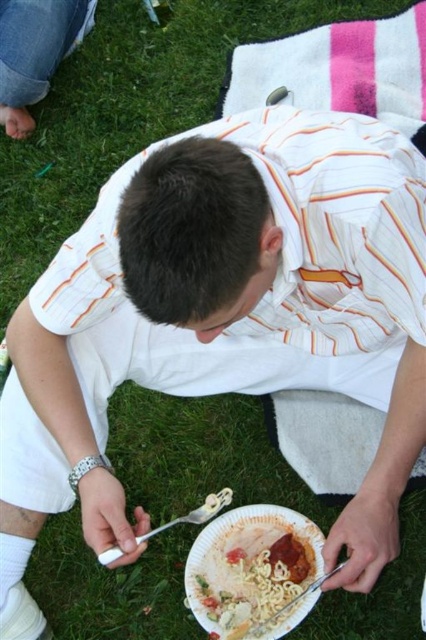
You are a person sitting on a grassy area and want to pick up your food from the white paper plate at lower center using the silver metallic fork at lower center. Which direction should you move the fork to reach the plate?

The white paper plate at lower center is to the right of the silver metallic fork at lower center, so you should move the fork to the right to reach the plate.

You are a photographer trying to capture the man and his meal. Since you want to focus on the white paper plate at lower center and the jeans at upper left, which object should you adjust your camera lens to focus on first considering their positions?

The white paper plate at lower center is closer to the viewer than the jeans at upper left, so you should focus on the white paper plate at lower center first.

You are a photographer setting up a tripod to capture the scene. The white paper plate at lower center and the jeans at upper left are in your viewfinder. Which object should you focus on first if you want to ensure both are in sharp focus, considering their heights?

The white paper plate at lower center has a lesser height compared to jeans at upper left, so you should focus on the jeans at upper left first to ensure both are in sharp focus.